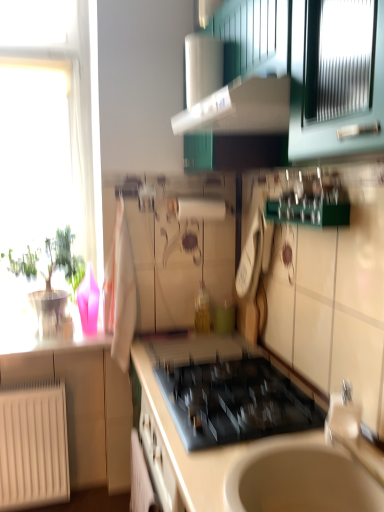
Image resolution: width=384 pixels, height=512 pixels. Find the location of `free location above white glossy countertop at center (from a real-world perspective)`. free location above white glossy countertop at center (from a real-world perspective) is located at coordinates (222, 381).